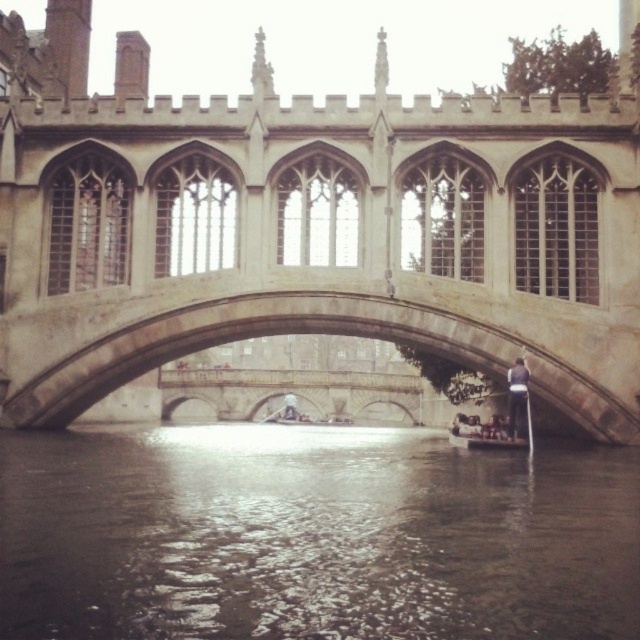
Question: Among these points, which one is farthest from the camera?

Choices:
 (A) (179, 109)
 (B) (483, 449)
 (C) (508, 493)

Answer: (B)

Question: Which point is farther to the camera?

Choices:
 (A) (332, 289)
 (B) (461, 442)
 (C) (189, 627)
 (D) (116, 333)

Answer: (B)

Question: Where is stone gothic bridge at center located in relation to stone bridge at center in the image?

Choices:
 (A) left
 (B) right

Answer: (A)

Question: Can you confirm if dark water at center is wider than wooden boat at lower center?

Choices:
 (A) no
 (B) yes

Answer: (B)

Question: Which point is farther to the camera?

Choices:
 (A) (522, 448)
 (B) (474, 333)
 (C) (209, 468)
 (D) (362, 99)

Answer: (A)

Question: Is stone gothic bridge at center below dark water at center?

Choices:
 (A) yes
 (B) no

Answer: (B)